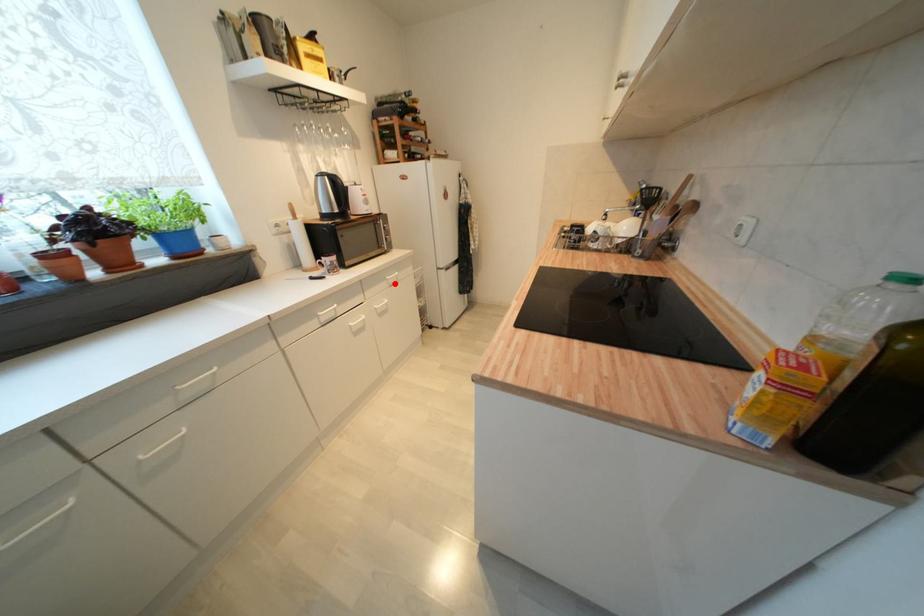
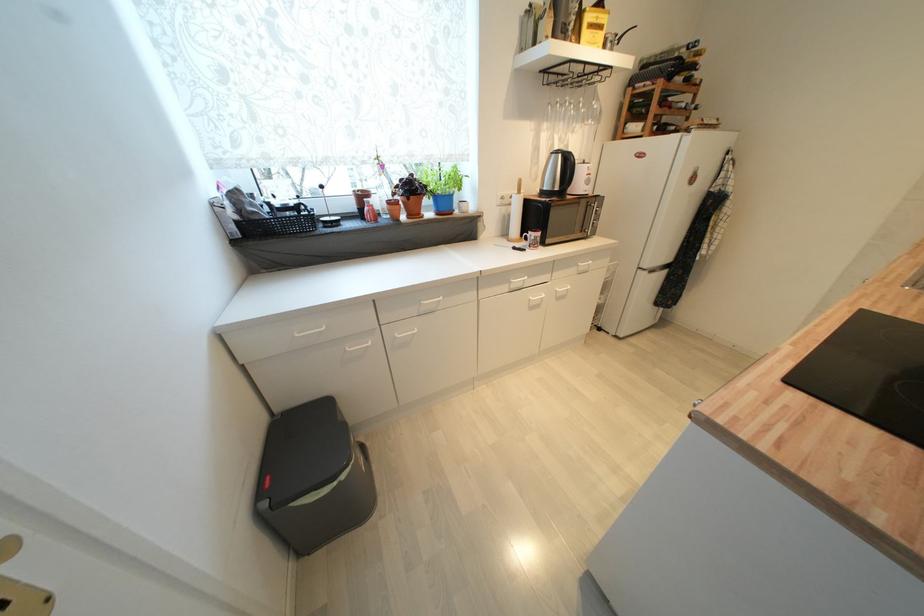
Find the pixel in the second image that matches the highlighted location in the first image.

(585, 270)